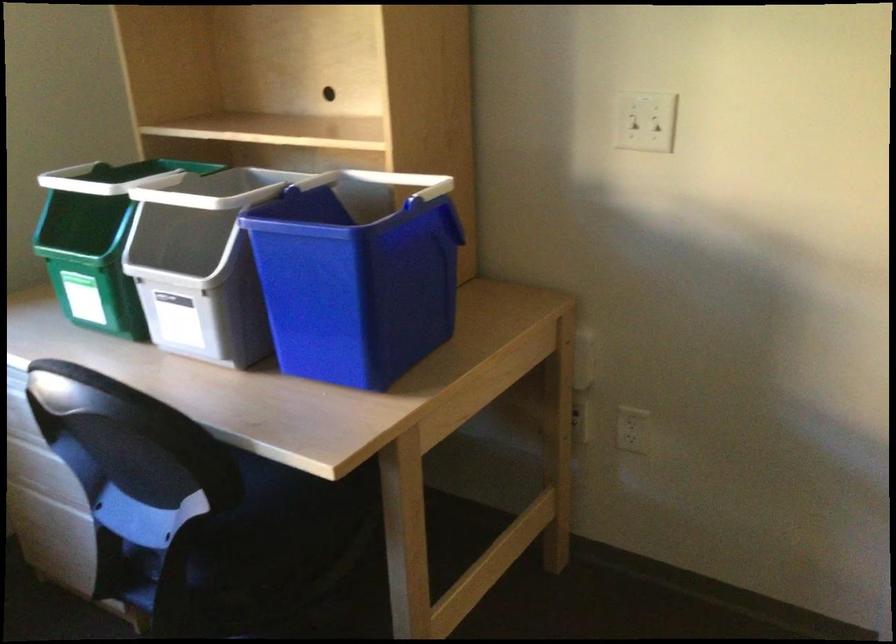
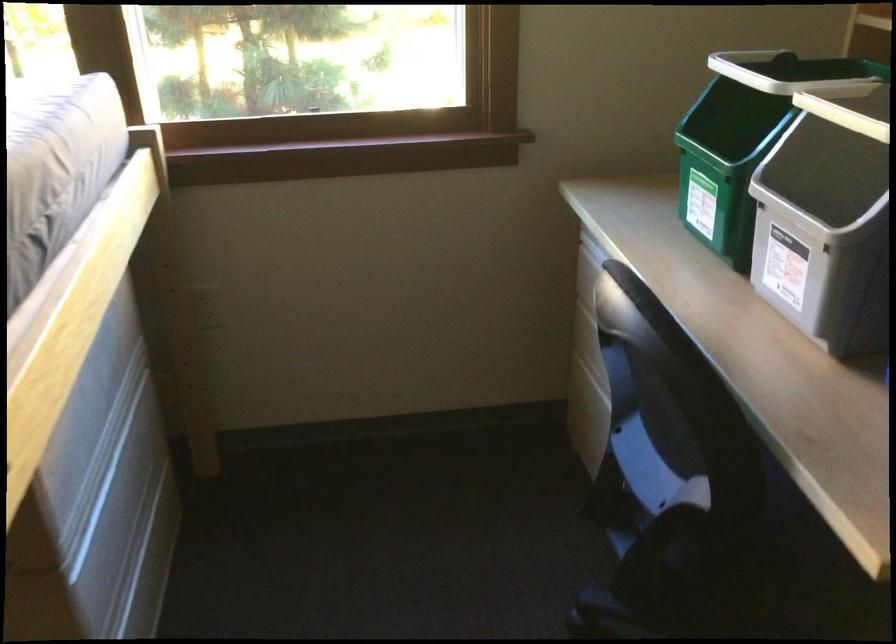
Question: Based on the continuous images, in which direction is the camera rotating? Reply with the corresponding letter.

Choices:
 (A) Left
 (B) Right
 (C) Up
 (D) Down

Answer: (A)